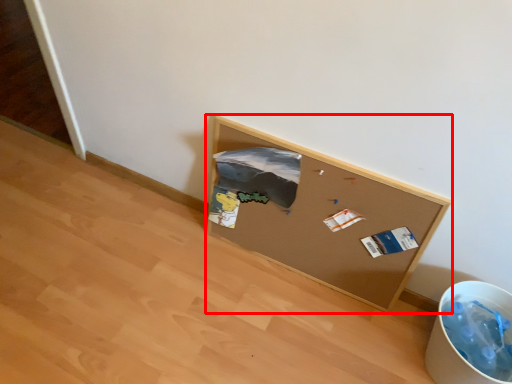
Question: From the image's perspective, where is furniture (annotated by the red box) located relative to recycling bin?

Choices:
 (A) above
 (B) below

Answer: (A)